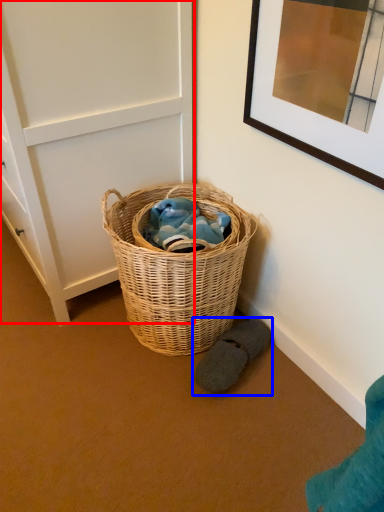
Question: Which object appears farthest to the camera in this image, door (highlighted by a red box) or footwear (highlighted by a blue box)?

Choices:
 (A) door
 (B) footwear

Answer: (B)